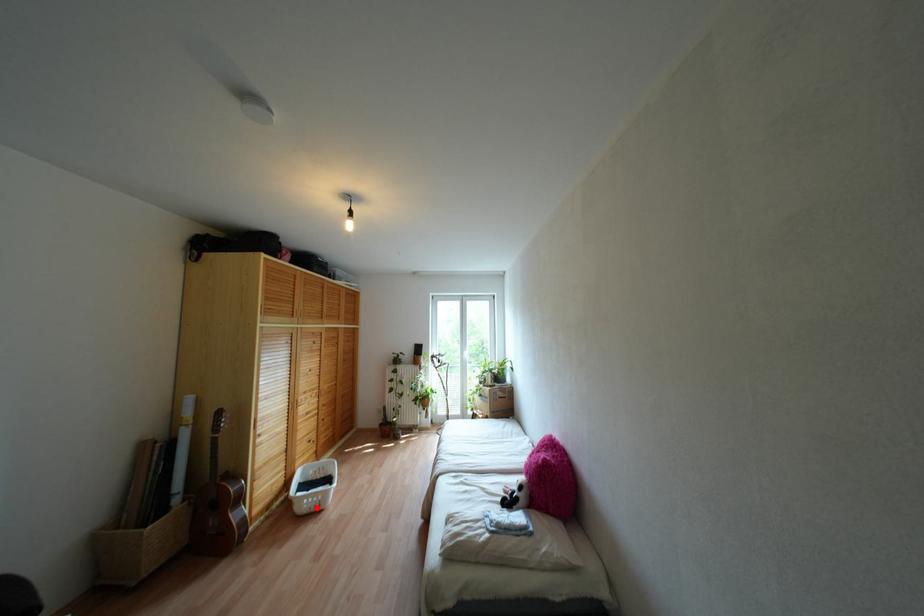
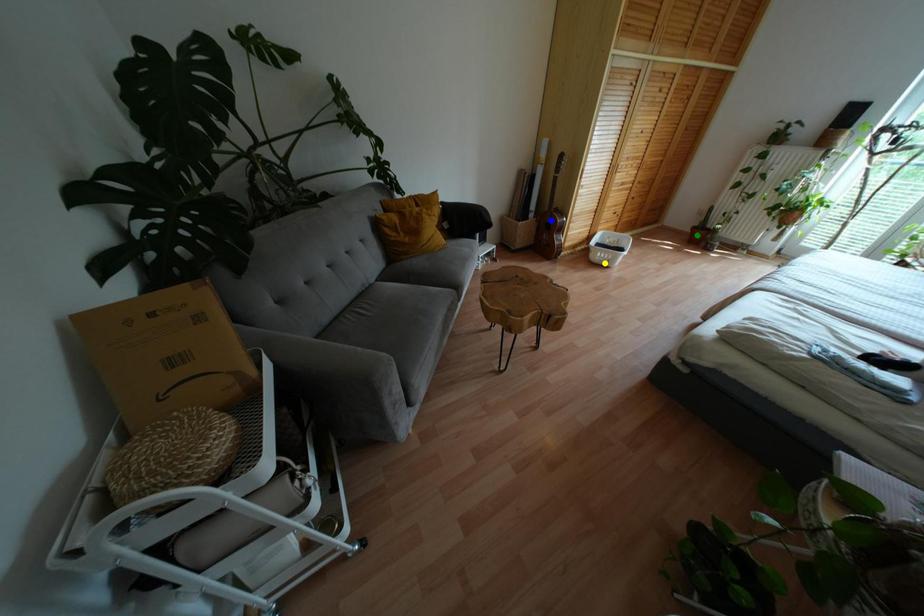
Question: I am providing you with two images of the same scene from different viewpoints. A red point is marked on the first image. You are given multiple points on the second image. Which mark in image 2 goes with the point in image 1?

Choices:
 (A) blue point
 (B) green point
 (C) yellow point

Answer: (C)